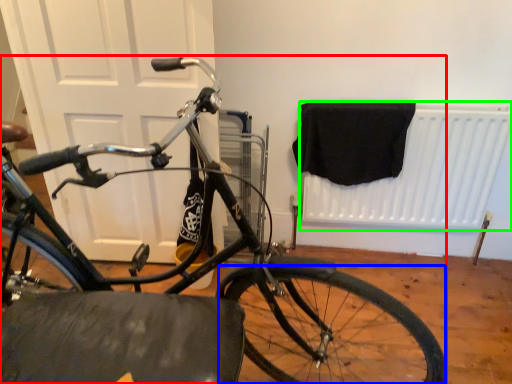
Question: Which object is positioned closest to bicycle (highlighted by a red box)? Select from bicycle wheel (highlighted by a blue box) and radiator (highlighted by a green box).

Choices:
 (A) bicycle wheel
 (B) radiator

Answer: (A)